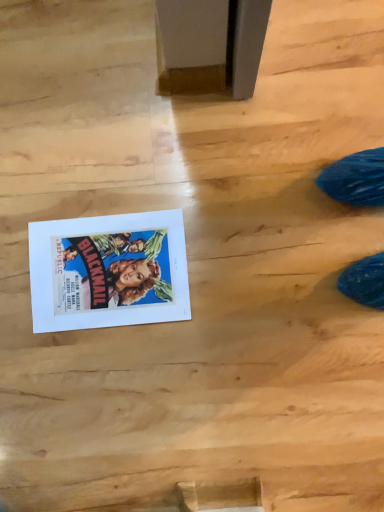
Question: Does matte paper poster at lower left touch wooden plank at lower center?

Choices:
 (A) no
 (B) yes

Answer: (A)

Question: Is matte paper poster at lower left at the left side of wooden plank at lower center?

Choices:
 (A) no
 (B) yes

Answer: (B)

Question: Does matte paper poster at lower left have a lesser width compared to wooden plank at lower center?

Choices:
 (A) yes
 (B) no

Answer: (B)

Question: Does matte paper poster at lower left have a larger size compared to wooden plank at lower center?

Choices:
 (A) no
 (B) yes

Answer: (B)

Question: Is matte paper poster at lower left further to the viewer compared to wooden plank at lower center?

Choices:
 (A) yes
 (B) no

Answer: (A)

Question: From the image's perspective, is matte paper poster at lower left over wooden plank at lower center?

Choices:
 (A) yes
 (B) no

Answer: (A)

Question: Considering the relative positions of wooden plank at lower center and matte paper poster at lower left in the image provided, is wooden plank at lower center to the left of matte paper poster at lower left from the viewer's perspective?

Choices:
 (A) no
 (B) yes

Answer: (A)

Question: From a real-world perspective, is wooden plank at lower center on top of matte paper poster at lower left?

Choices:
 (A) yes
 (B) no

Answer: (A)

Question: Is matte paper poster at lower left completely or partially inside wooden plank at lower center?

Choices:
 (A) no
 (B) yes

Answer: (A)

Question: Can you confirm if wooden plank at lower center is thinner than matte paper poster at lower left?

Choices:
 (A) no
 (B) yes

Answer: (B)

Question: Is wooden plank at lower center smaller than matte paper poster at lower left?

Choices:
 (A) no
 (B) yes

Answer: (B)

Question: From a real-world perspective, does wooden plank at lower center sit lower than matte paper poster at lower left?

Choices:
 (A) no
 (B) yes

Answer: (A)

Question: Looking at the image, does matte paper poster at lower left seem bigger or smaller compared to wooden plank at lower center?

Choices:
 (A) small
 (B) big

Answer: (B)